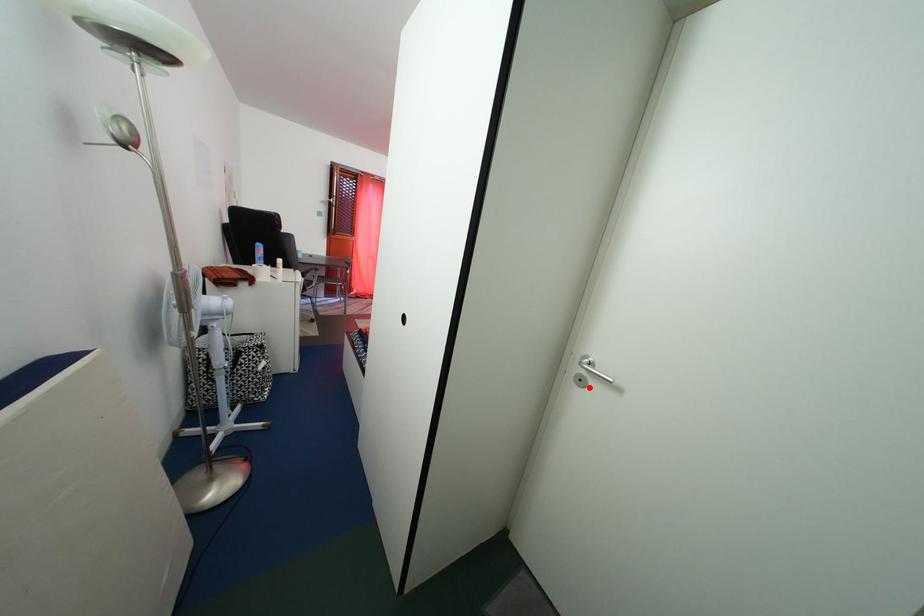
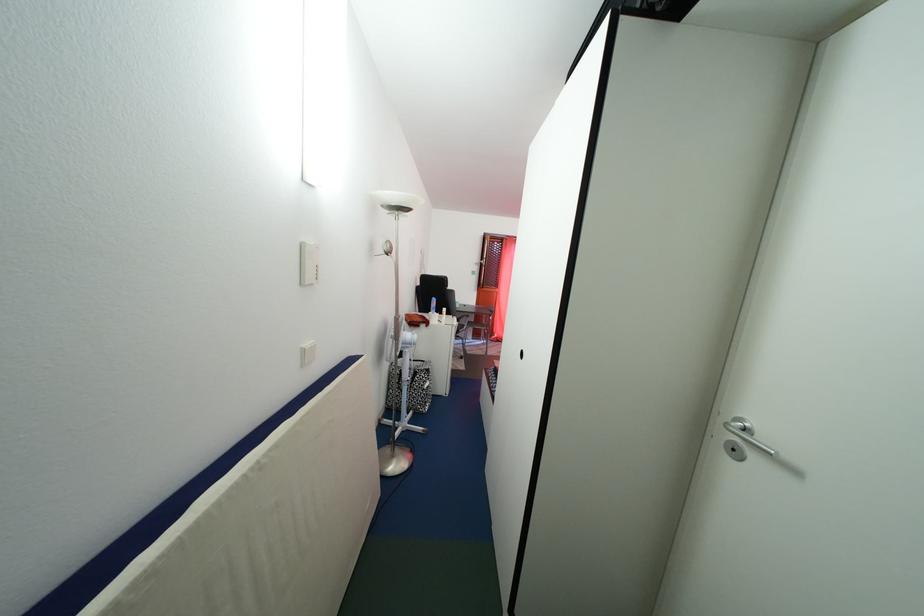
Find the pixel in the second image that matches the highlighted location in the first image.

(743, 456)